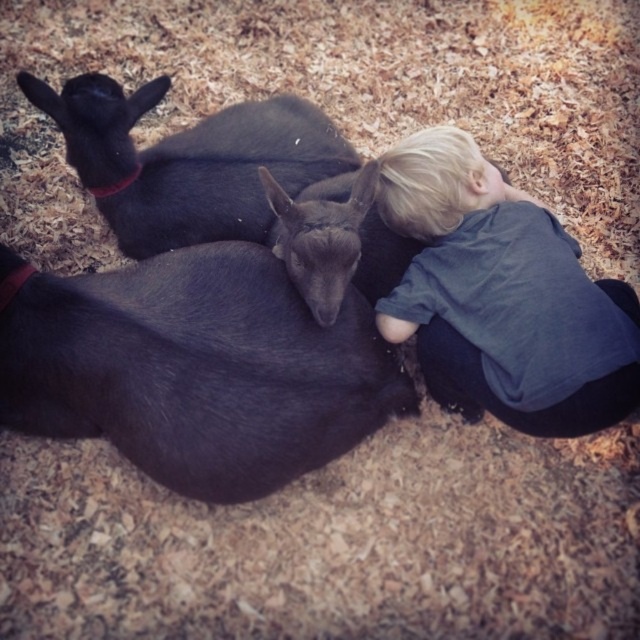
Which is below, shiny black goat at center or blonde hair at upper right?

shiny black goat at center is below.

Is point (33, 276) more distant than point (532, 241)?

No, it is in front of (532, 241).

Which is in front, point (3, 260) or point (604, 339)?

Point (604, 339) is more forward.

The height and width of the screenshot is (640, 640). Identify the location of shiny black goat at center. (196, 365).